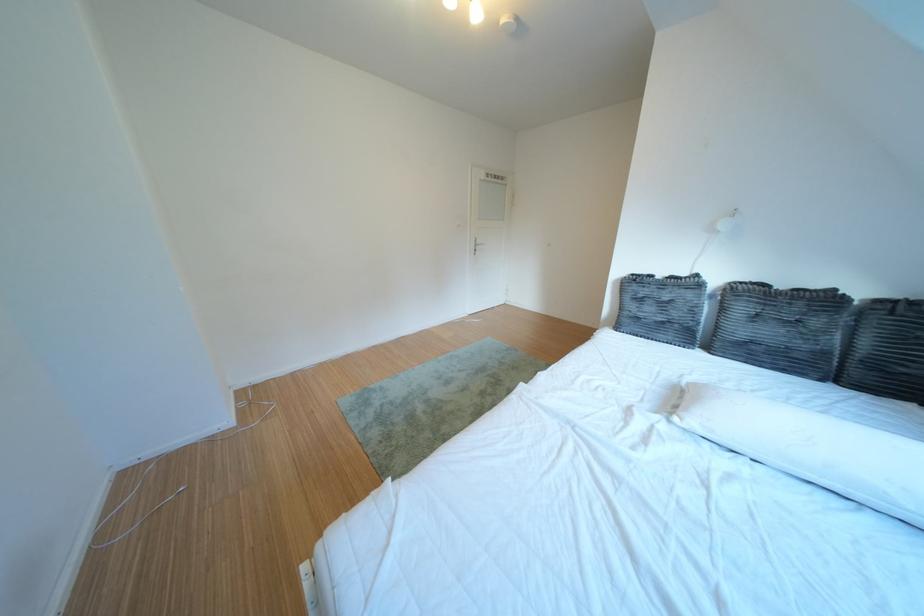
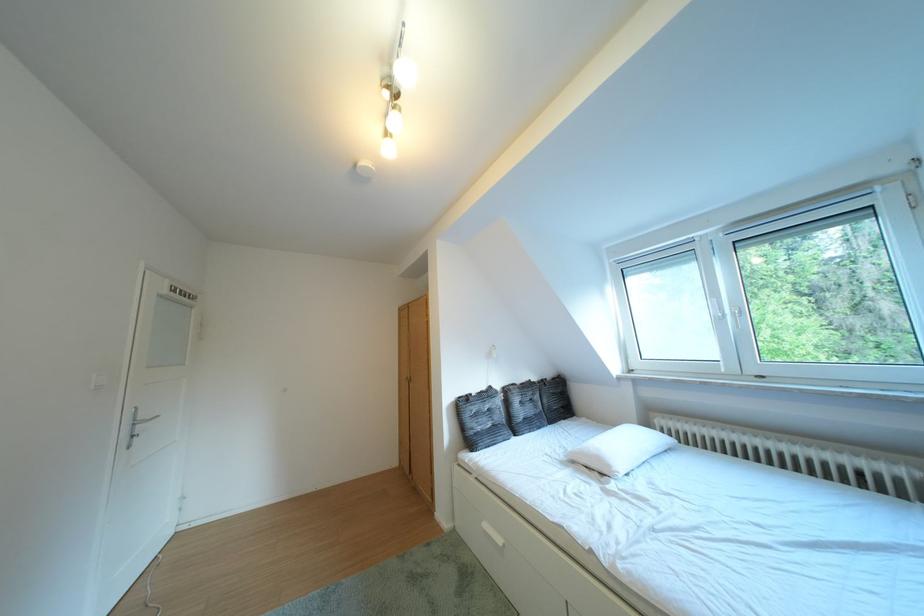
Locate, in the second image, the point that corresponds to point (711, 281) in the first image.

(504, 392)